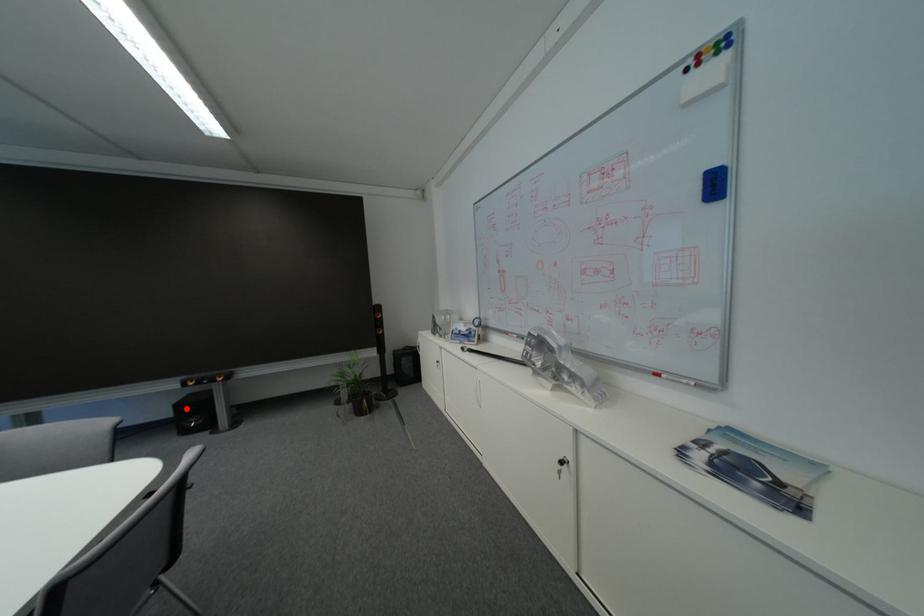
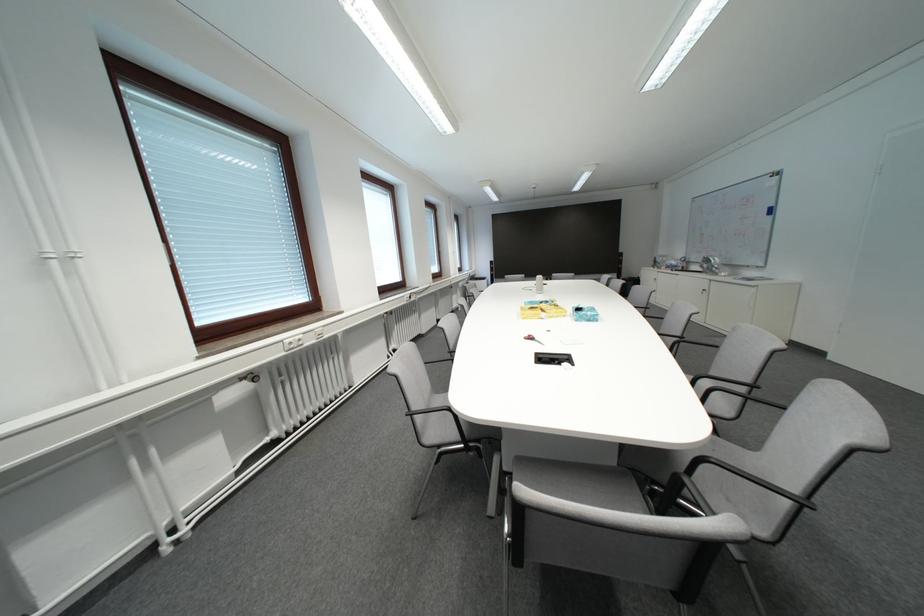
Question: I am providing you with two images of the same scene from different viewpoints. A red point is marked on the first image. Can you still see the location of the red point in image 2?

Choices:
 (A) Yes
 (B) No

Answer: (B)